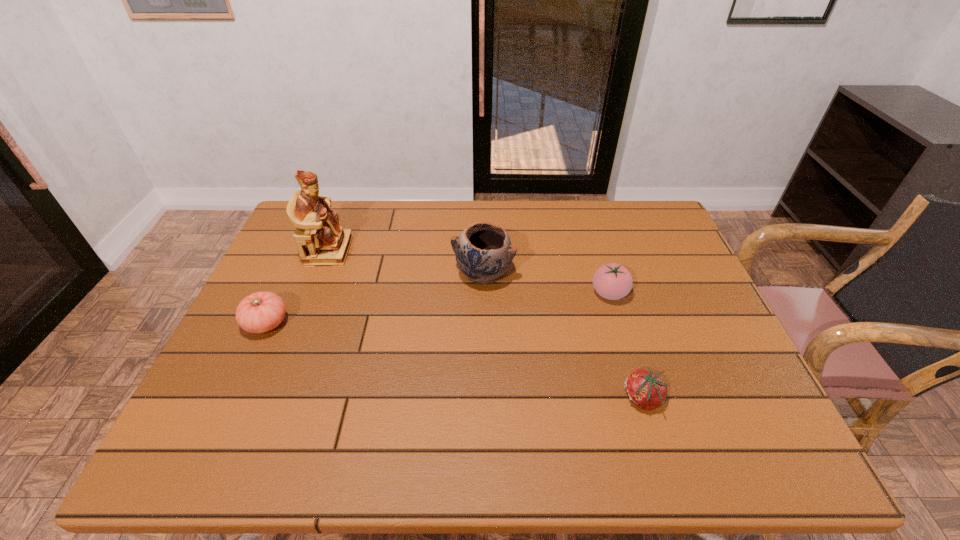
Where is `blank area in the image that satisfies the following two spatial constraints: 1. on the back side of the nearest object; 2. on the front-facing side of the figurine`? blank area in the image that satisfies the following two spatial constraints: 1. on the back side of the nearest object; 2. on the front-facing side of the figurine is located at coordinates (598, 251).

Find the location of `free space that satisfies the following two spatial constraints: 1. on the front-facing side of the figurine; 2. on the back side of the third object from left to right`. free space that satisfies the following two spatial constraints: 1. on the front-facing side of the figurine; 2. on the back side of the third object from left to right is located at coordinates (320, 274).

Locate an element on the screen. The width and height of the screenshot is (960, 540). vacant region that satisfies the following two spatial constraints: 1. on the front-facing side of the figurine; 2. on the left side of the shortest object is located at coordinates (271, 399).

Find the location of `vacant region that satisfies the following two spatial constraints: 1. on the front-facing side of the figurine; 2. on the left side of the nearest tomato`. vacant region that satisfies the following two spatial constraints: 1. on the front-facing side of the figurine; 2. on the left side of the nearest tomato is located at coordinates (271, 399).

The width and height of the screenshot is (960, 540). In order to click on vacant position in the image that satisfies the following two spatial constraints: 1. on the back side of the leftmost tomato; 2. on the right side of the third object from left to right in this screenshot , I will do `click(289, 274)`.